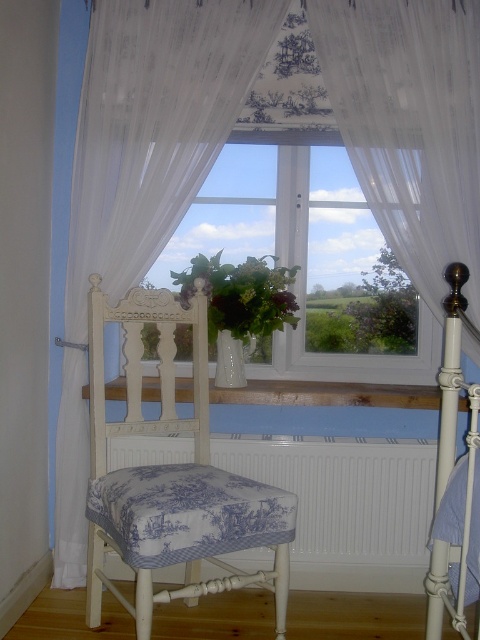
Question: Does white textured radiator at lower center appear over white painted metal bed at right?

Choices:
 (A) no
 (B) yes

Answer: (A)

Question: Does white painted metal bed at right have a lesser width compared to white wooden balustrade at center?

Choices:
 (A) no
 (B) yes

Answer: (B)

Question: Among these objects, which one is nearest to the camera?

Choices:
 (A) white painted metal bed at right
 (B) white textured radiator at lower center
 (C) white glass window at center
 (D) white painted wood chair at center

Answer: (A)

Question: Which point is farther to the camera?

Choices:
 (A) (474, 330)
 (B) (259, 387)
 (C) (304, 308)

Answer: (C)

Question: Is white painted wood chair at center positioned before white painted metal bed at right?

Choices:
 (A) yes
 (B) no

Answer: (B)

Question: Which object is closer to the camera taking this photo?

Choices:
 (A) white painted metal bed at right
 (B) white glass window at center

Answer: (A)